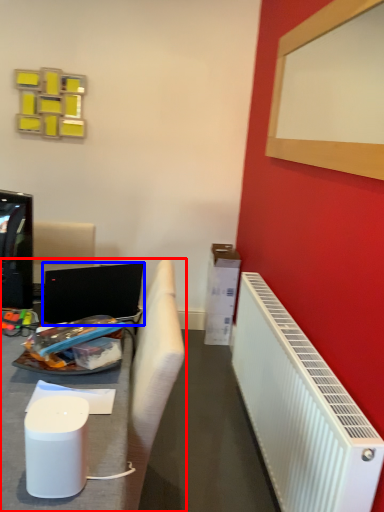
Question: Which object appears closest to the camera in this image, furniture (highlighted by a red box) or laptop (highlighted by a blue box)?

Choices:
 (A) furniture
 (B) laptop

Answer: (A)